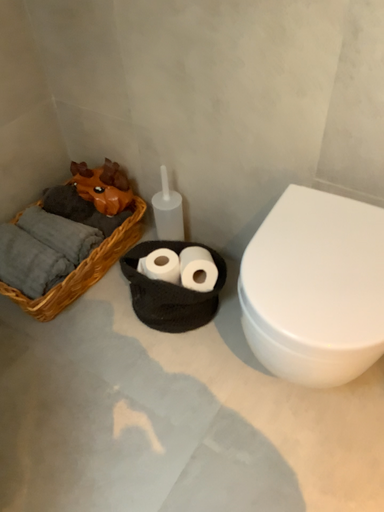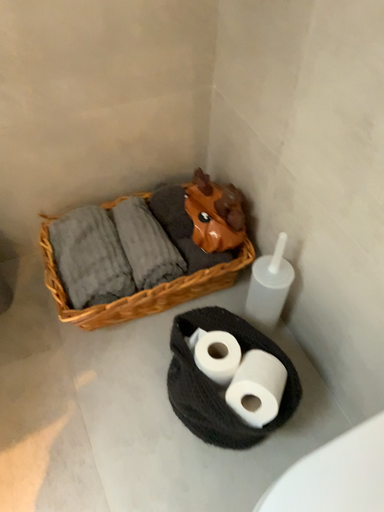
Question: How did the camera likely rotate when shooting the video?

Choices:
 (A) rotated right
 (B) rotated left

Answer: (B)